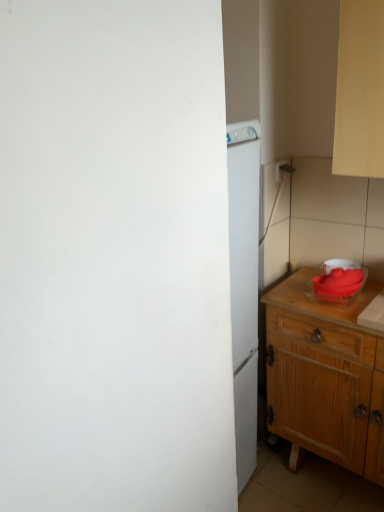
Question: Is white plastic electric outlet at upper right inside or outside of matte red bowl at right?

Choices:
 (A) outside
 (B) inside

Answer: (A)

Question: Does point pos(278,172) appear closer or farther from the camera than point pos(339,276)?

Choices:
 (A) farther
 (B) closer

Answer: (A)

Question: Estimate the real-world distances between objects in this image. Which object is closer to the wooden cabinet at right?

Choices:
 (A) white plastic electric outlet at upper right
 (B) matte red bowl at right

Answer: (B)

Question: Which is nearer to the matte red bowl at right?

Choices:
 (A) wooden cabinet at right
 (B) white plastic electric outlet at upper right

Answer: (A)